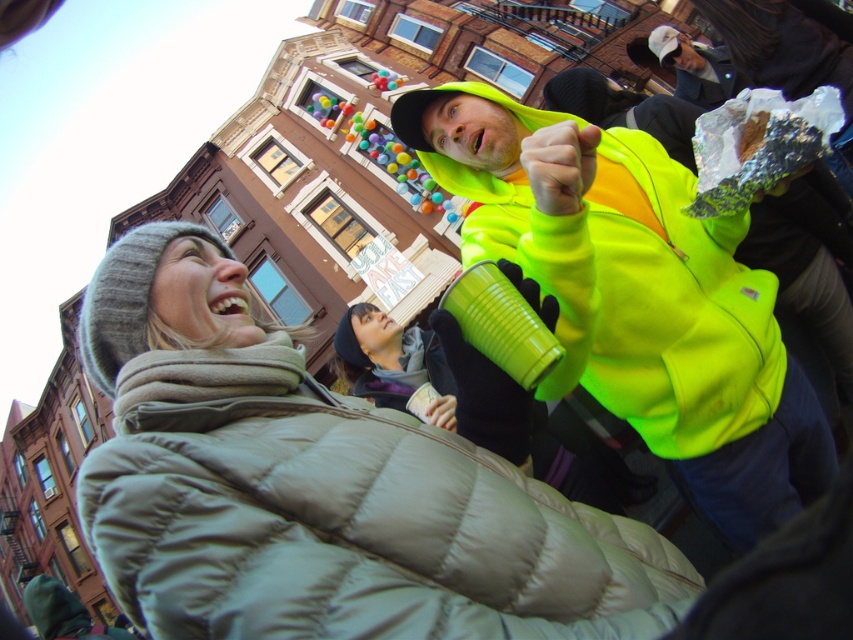
Question: Which point appears farthest from the camera in this image?

Choices:
 (A) (453, 192)
 (B) (241, 301)
 (C) (459, 440)
 (D) (740, 84)

Answer: (D)

Question: Which point is closer to the camera taking this photo?

Choices:
 (A) (560, 305)
 (B) (679, 74)
 (C) (346, 499)

Answer: (C)

Question: Does neon yellow fleece at center appear on the right side of white glossy teeth at center?

Choices:
 (A) no
 (B) yes

Answer: (B)

Question: Can you confirm if neon yellow fleece at center is smaller than white glossy teeth at center?

Choices:
 (A) yes
 (B) no

Answer: (B)

Question: Which object appears closest to the camera in this image?

Choices:
 (A) white glossy teeth at center
 (B) neon yellow fleece at center
 (C) white cotton cap at upper right

Answer: (B)

Question: Is neon yellow fleece at center thinner than white glossy teeth at center?

Choices:
 (A) no
 (B) yes

Answer: (A)